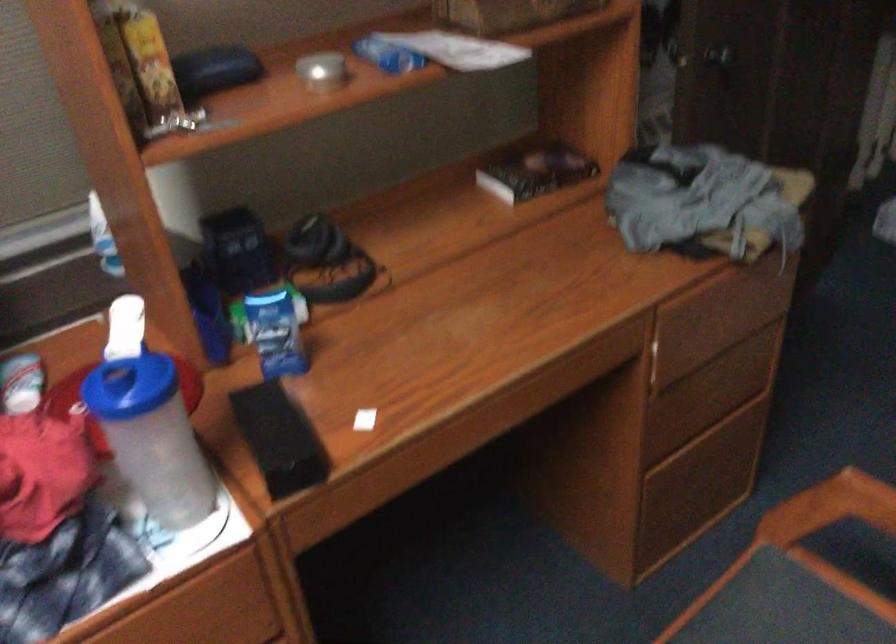
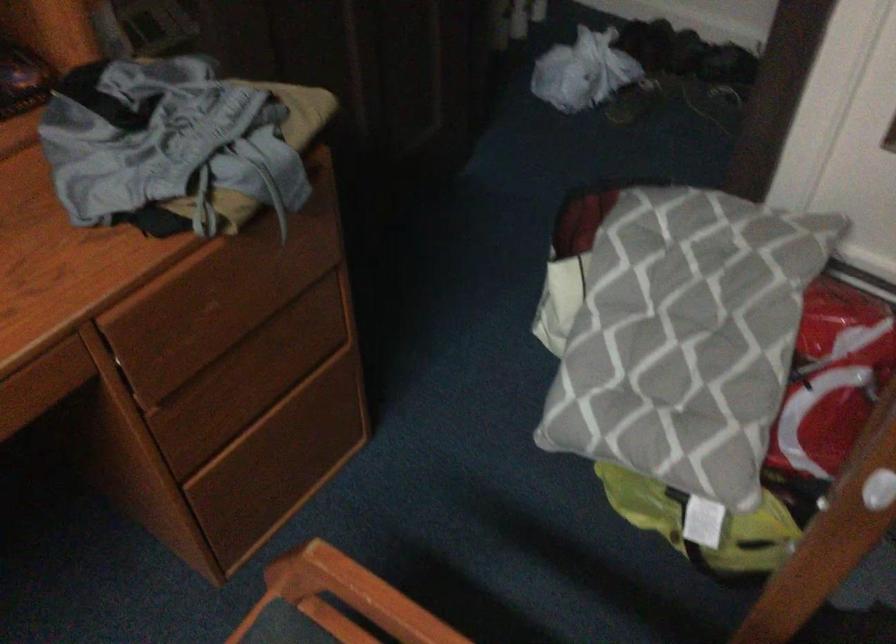
Question: The images are taken continuously from a first-person perspective. In which direction is your viewpoint rotating?

Choices:
 (A) Left
 (B) Right
 (C) Up
 (D) Down

Answer: (B)